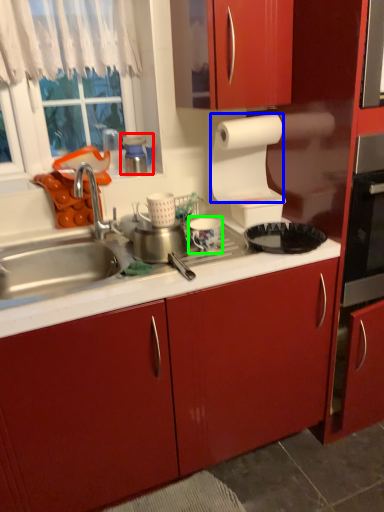
Question: Considering the real-world distances, which object is closest to appliance (highlighted by a red box)? paper towel (highlighted by a blue box) or appliance (highlighted by a green box).

Choices:
 (A) paper towel
 (B) appliance

Answer: (A)